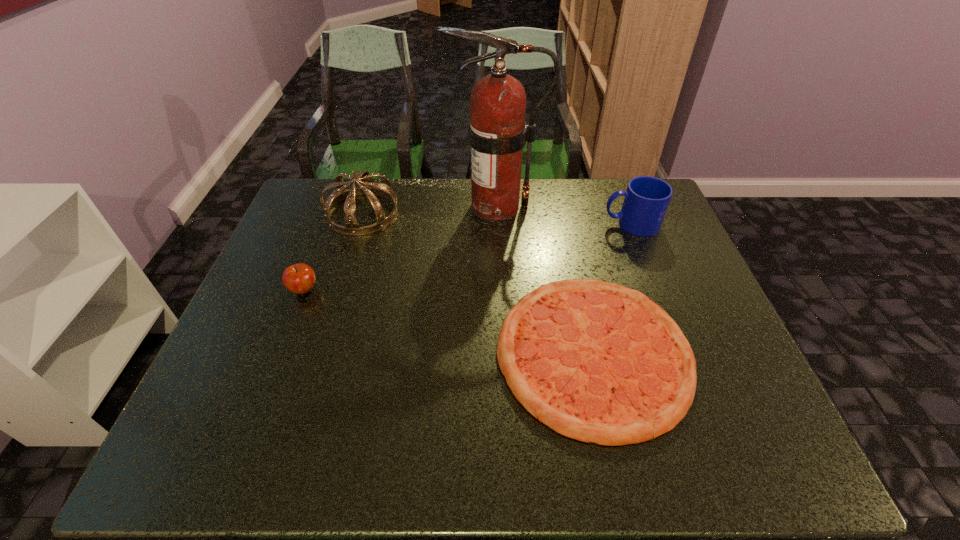
Where is `mug that is at the right edge`? This screenshot has height=540, width=960. mug that is at the right edge is located at coordinates (646, 200).

Find the location of a particular element. This screenshot has height=540, width=960. pizza that is at the right edge is located at coordinates pos(598,362).

You are a GUI agent. You are given a task and a screenshot of the screen. Output one action in this format:
    pyautogui.click(x=<x>, y=<y>)
    Task: Click on the object that is at the far left corner
    The height and width of the screenshot is (540, 960).
    Given the screenshot: What is the action you would take?
    pyautogui.click(x=367, y=187)

Find the location of a particular element. Image resolution: width=960 pixels, height=540 pixels. object positioned at the far right corner is located at coordinates [x=646, y=200].

The width and height of the screenshot is (960, 540). What are the coordinates of `object that is at the near right corner` in the screenshot? It's located at (598, 362).

The height and width of the screenshot is (540, 960). What are the coordinates of `vacant space at the far edge of the desktop` in the screenshot? It's located at (444, 213).

Locate an element on the screen. The image size is (960, 540). vacant area at the near edge of the desktop is located at coordinates (261, 459).

Locate an element on the screen. blank space at the left edge of the desktop is located at coordinates (260, 276).

Identify the location of free spot at the right edge of the desktop. The image size is (960, 540). (668, 258).

I want to click on vacant position at the far left corner of the desktop, so click(337, 213).